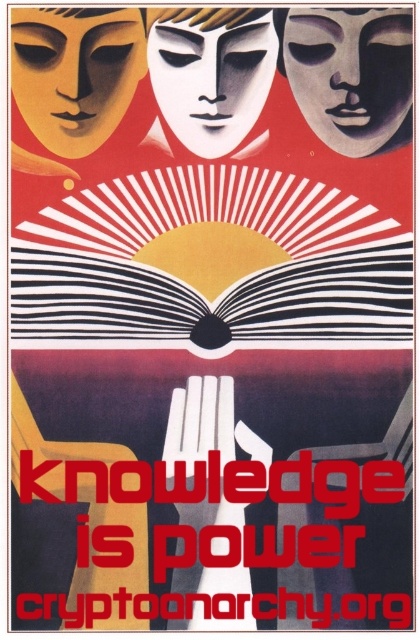
Question: Can you confirm if matte black mask at upper center is bigger than matte gold mask at upper left?

Choices:
 (A) yes
 (B) no

Answer: (B)

Question: Which of the following is the closest to the observer?

Choices:
 (A) (x=146, y=65)
 (B) (x=367, y=129)
 (C) (x=236, y=60)

Answer: (A)

Question: Which object is the closest to the white matte mask at center?

Choices:
 (A) matte gold mask at upper left
 (B) matte black mask at upper center

Answer: (A)

Question: Does matte black mask at upper center have a larger size compared to matte gold mask at upper left?

Choices:
 (A) yes
 (B) no

Answer: (B)

Question: Estimate the real-world distances between objects in this image. Which object is closer to the matte gold mask at upper left?

Choices:
 (A) matte black mask at upper center
 (B) white matte mask at center

Answer: (B)

Question: Can you confirm if matte black mask at upper center is bigger than matte gold mask at upper left?

Choices:
 (A) yes
 (B) no

Answer: (B)